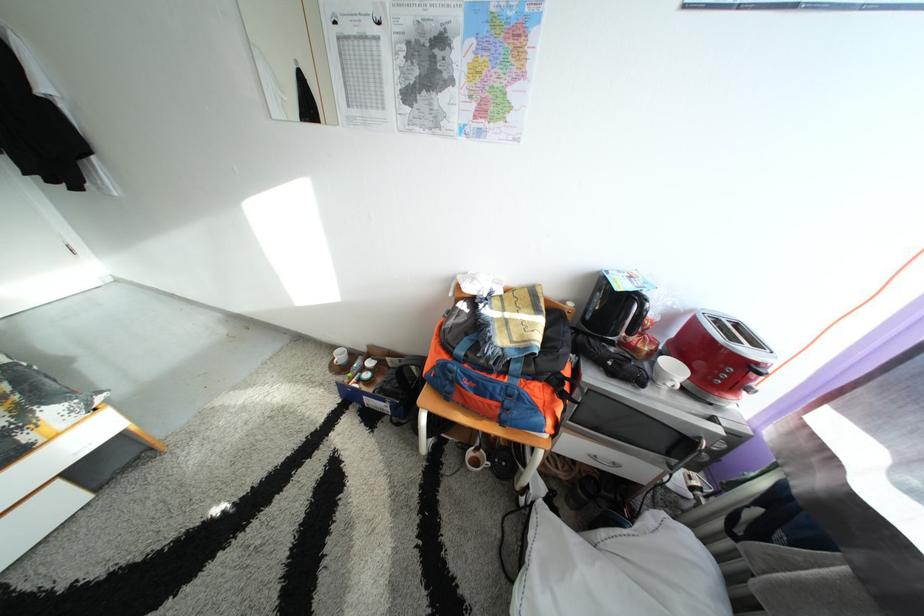
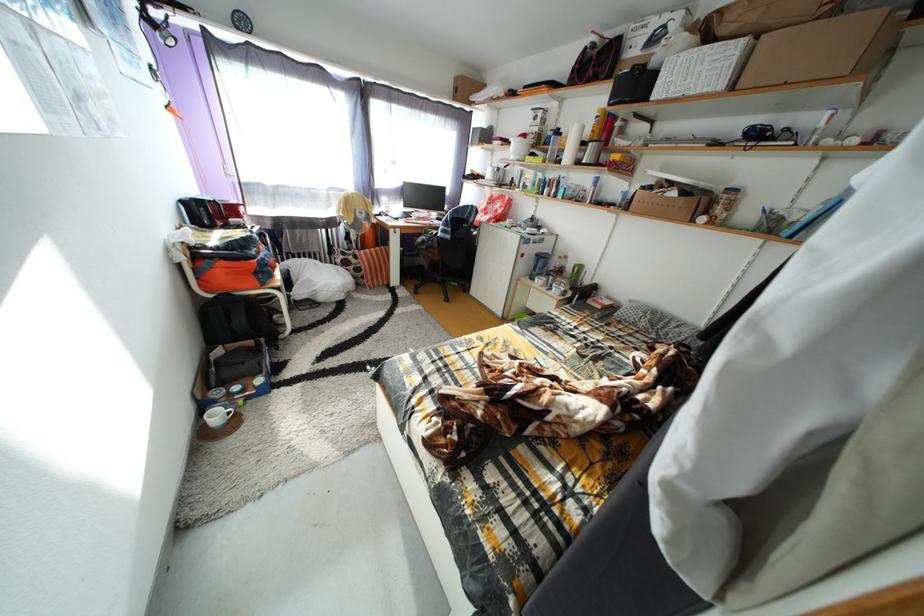
Question: I am providing you with two images of the same scene from different viewpoints. Please identify which objects are invisible in image2.

Choices:
 (A) black kettle handle
 (B) red plastic bottle
 (C) black spray bottle
 (D) white mug handle

Answer: (A)